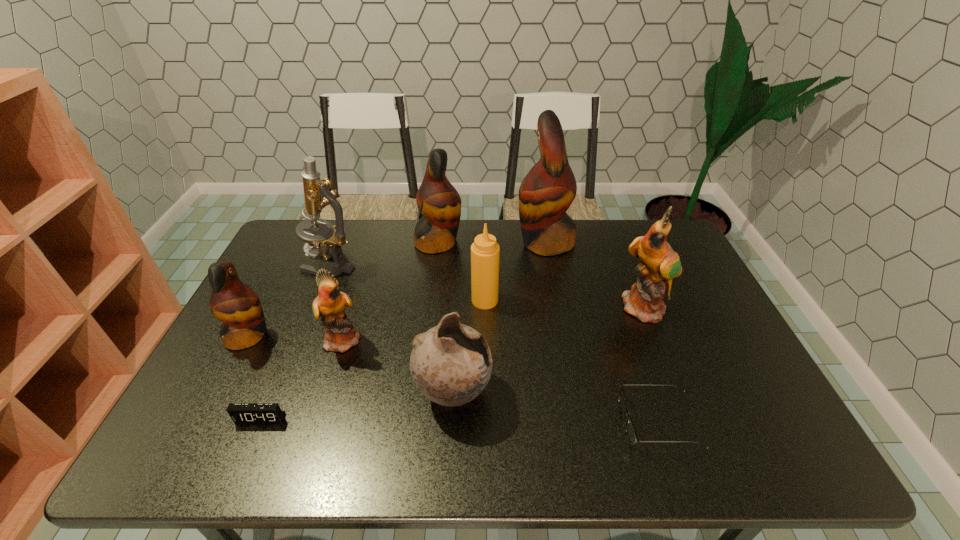
You are a GUI agent. You are given a task and a screenshot of the screen. Output one action in this format:
    pyautogui.click(x=<x>, y=<y>)
    Task: Click on the object that is positioned at the near edge
    Image resolution: width=960 pixels, height=540 pixels.
    Given the screenshot: What is the action you would take?
    pyautogui.click(x=631, y=433)

You are a GUI agent. You are given a task and a screenshot of the screen. Output one action in this format:
    pyautogui.click(x=<x>, y=<y>)
    Task: Click on the microscope that is at the left edge
    The width and height of the screenshot is (960, 540).
    Given the screenshot: What is the action you would take?
    pyautogui.click(x=317, y=195)

The width and height of the screenshot is (960, 540). What are the coordinates of `parrot present at the left edge` in the screenshot? It's located at (236, 304).

Identify the location of alarm clock positioned at the left edge. This screenshot has width=960, height=540. (241, 413).

Where is `object that is positioned at the right edge`? The height and width of the screenshot is (540, 960). object that is positioned at the right edge is located at coordinates (660, 264).

Where is `object that is at the far left corner`? object that is at the far left corner is located at coordinates (317, 195).

In the image, there is a desktop. Identify the location of vacant space at the far edge. This screenshot has width=960, height=540. (381, 248).

At what (x,y) coordinates should I click in order to perform the action: click on free space at the near edge. Please return your answer as a coordinate pair (x, y). Looking at the image, I should click on click(x=389, y=450).

In the image, there is a desktop. At what (x,y) coordinates should I click in order to perform the action: click on blank space at the left edge. Please return your answer as a coordinate pair (x, y). Looking at the image, I should click on (292, 272).

In the image, there is a desktop. Where is `free space at the right edge`? This screenshot has height=540, width=960. free space at the right edge is located at coordinates (745, 377).